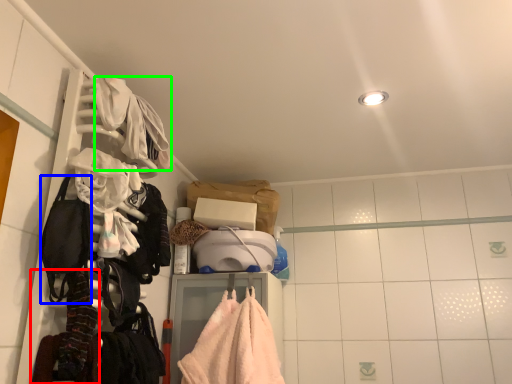
Question: Which object is positioned farthest from clothing (highlighted by a red box)? Select from gear (highlighted by a blue box) and clothing (highlighted by a green box).

Choices:
 (A) gear
 (B) clothing

Answer: (B)